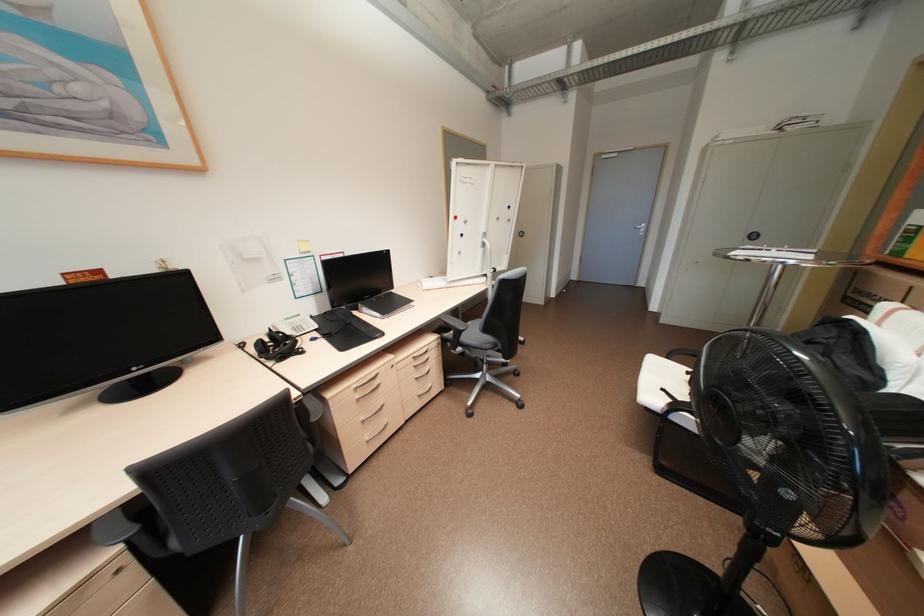
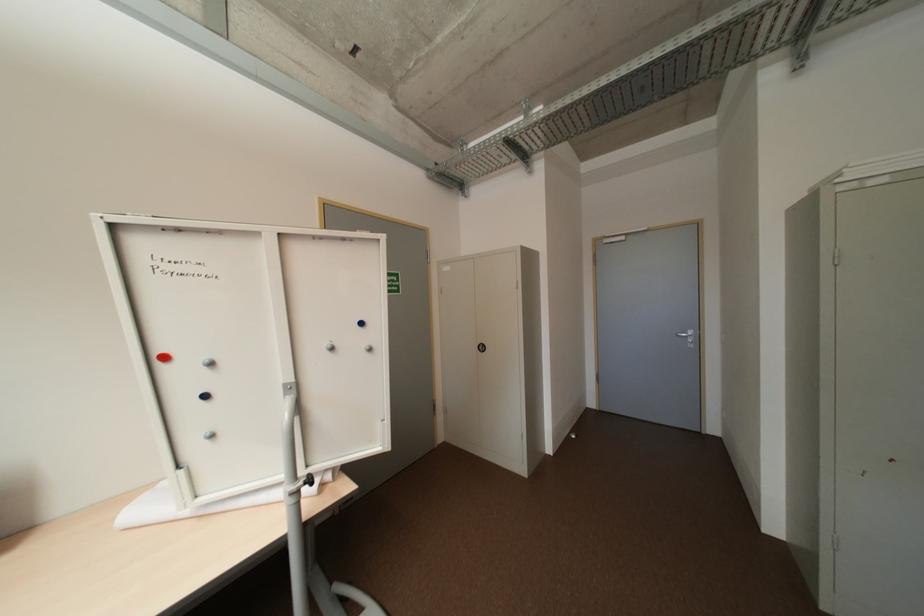
Which direction would the cameraman need to move to produce the second image?

The cameraman moved toward right, forward.